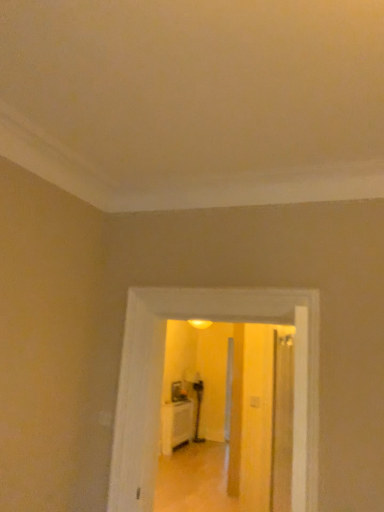
Question: Should I look upward or downward to see white glossy door at center?

Choices:
 (A) up
 (B) down

Answer: (B)